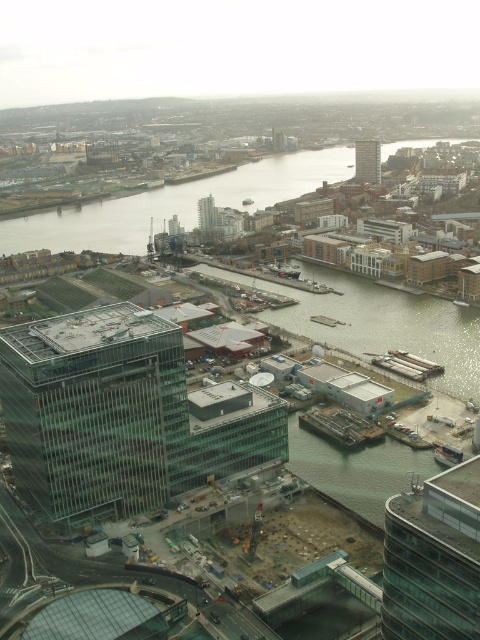
In the scene shown: Can you confirm if transparent glass building at center is positioned below clear water at center?

Yes, transparent glass building at center is below clear water at center.

Between transparent glass building at center and clear water at center, which one appears on the left side from the viewer's perspective?

transparent glass building at center

Which is in front, point (52, 371) or point (236, 192)?

Point (52, 371) is in front.

Where is `transparent glass building at center`? The width and height of the screenshot is (480, 640). transparent glass building at center is located at coordinates (121, 416).

Measure the distance between point (373,172) and camera.

They are 649.41 meters apart.

Does glassy concrete building at upper right have a smaller size compared to glassy concrete building at center?

No.

You are a GUI agent. You are given a task and a screenshot of the screen. Output one action in this format:
    pyautogui.click(x=<x>, y=<y>)
    Task: Click on the glassy concrete building at upper right
    
    Given the screenshot: What is the action you would take?
    pyautogui.click(x=368, y=161)

Is transparent glass building at center taller than green concrete waterway at center?

Incorrect, transparent glass building at center's height is not larger of green concrete waterway at center's.

Is transparent glass building at center positioned at the back of green concrete waterway at center?

No, it is in front of green concrete waterway at center.

Is point (27, 444) closer to camera compared to point (302, 332)?

Yes, it is.

You are a GUI agent. You are given a task and a screenshot of the screen. Output one action in this format:
    pyautogui.click(x=<x>, y=<y>)
    Task: Click on the transparent glass building at center
    
    Given the screenshot: What is the action you would take?
    pyautogui.click(x=121, y=416)